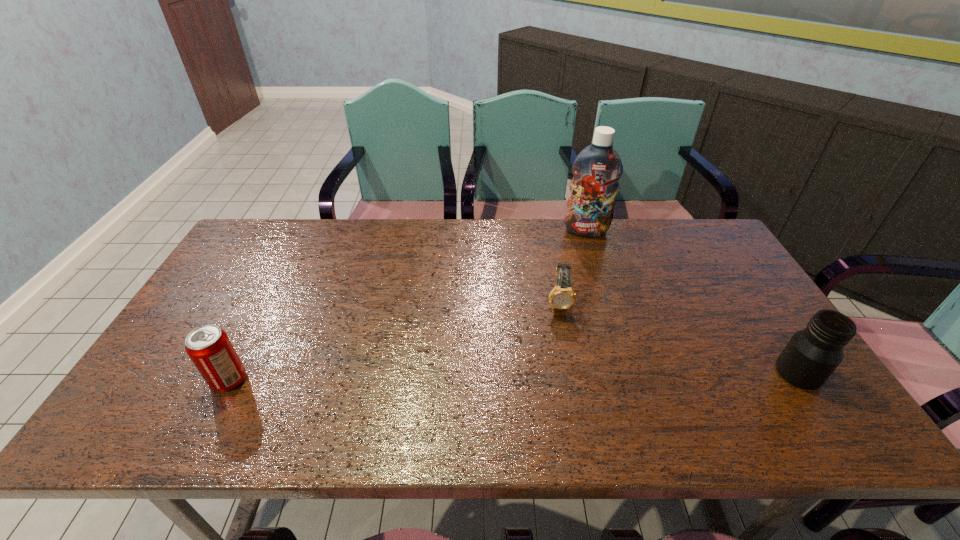
Where is `unoccupied area between the second object from left to right and the soda can`? The width and height of the screenshot is (960, 540). unoccupied area between the second object from left to right and the soda can is located at coordinates (394, 341).

At what (x,y) coordinates should I click in order to perform the action: click on vacant region between the soda can and the watch. Please return your answer as a coordinate pair (x, y). The height and width of the screenshot is (540, 960). Looking at the image, I should click on [x=394, y=341].

Where is `free space between the third object from left to right and the watch`? The height and width of the screenshot is (540, 960). free space between the third object from left to right and the watch is located at coordinates (572, 266).

Locate an element on the screen. vacant space that is in between the watch and the shampoo is located at coordinates (572, 266).

Where is `blank region between the jar and the soda can`? The image size is (960, 540). blank region between the jar and the soda can is located at coordinates (514, 376).

At what (x,y) coordinates should I click in order to perform the action: click on vacant space that is in between the soda can and the third object from left to right. Please return your answer as a coordinate pair (x, y). Looking at the image, I should click on (407, 306).

I want to click on vacant space that's between the second farthest object and the soda can, so click(394, 341).

The height and width of the screenshot is (540, 960). I want to click on object that stands as the second closest to the farthest object, so click(x=812, y=354).

This screenshot has width=960, height=540. Find the location of `object that ranks as the second closest to the third nearest object`. object that ranks as the second closest to the third nearest object is located at coordinates (812, 354).

Locate an element on the screen. This screenshot has height=540, width=960. free space in the image that satisfies the following two spatial constraints: 1. on the front side of the farthest object; 2. on the right side of the rightmost object is located at coordinates (631, 373).